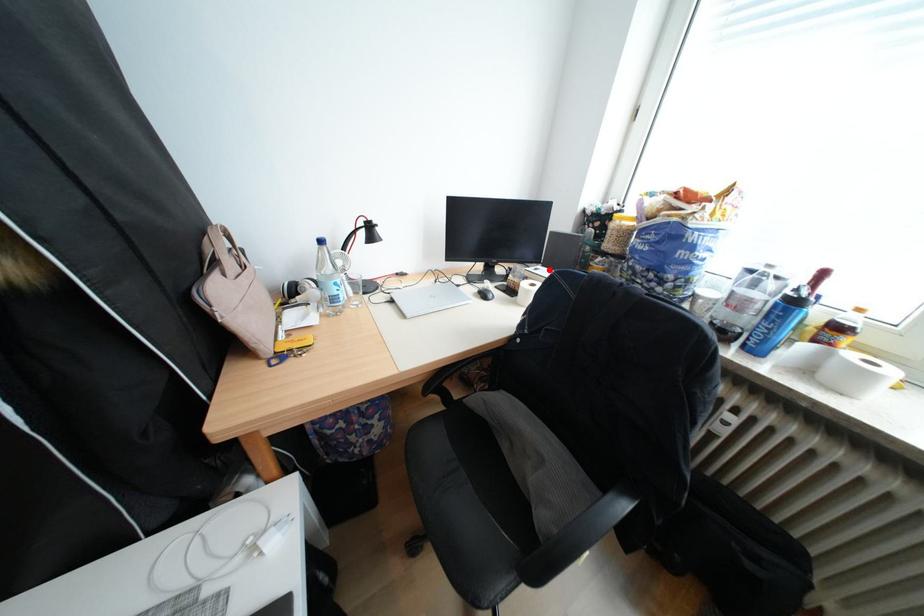
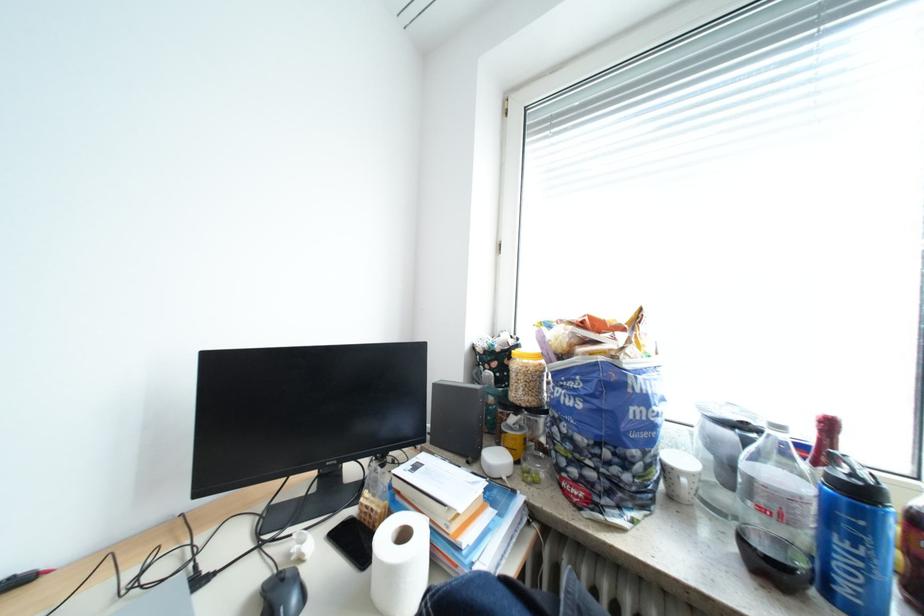
Question: I am providing you with two images of the same scene from different viewpoints. A red point is marked on the first image. At the location where the point appears in image 1, is it still visible in image 2?

Choices:
 (A) Yes
 (B) No

Answer: (A)